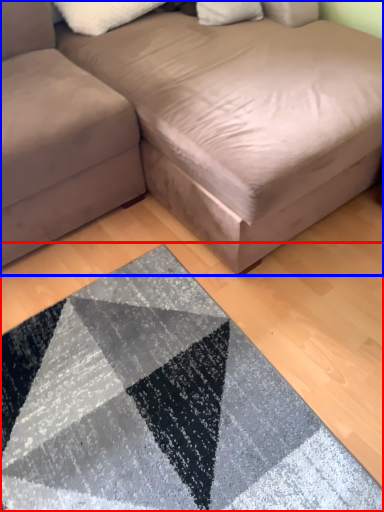
Question: Which object is closer to the camera taking this photo, mat (highlighted by a red box) or studio couch (highlighted by a blue box)?

Choices:
 (A) mat
 (B) studio couch

Answer: (B)